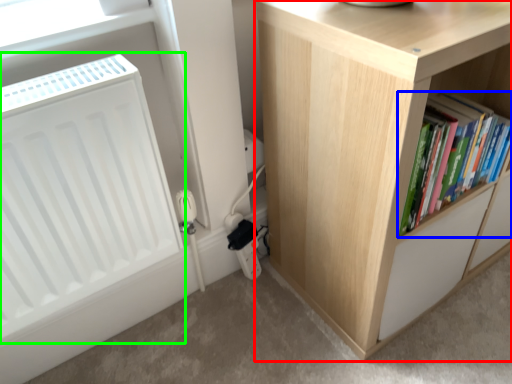
Question: Considering the real-world distances, which object is farthest from cupboard (highlighted by a red box)? book (highlighted by a blue box) or radiator (highlighted by a green box)?

Choices:
 (A) book
 (B) radiator

Answer: (B)